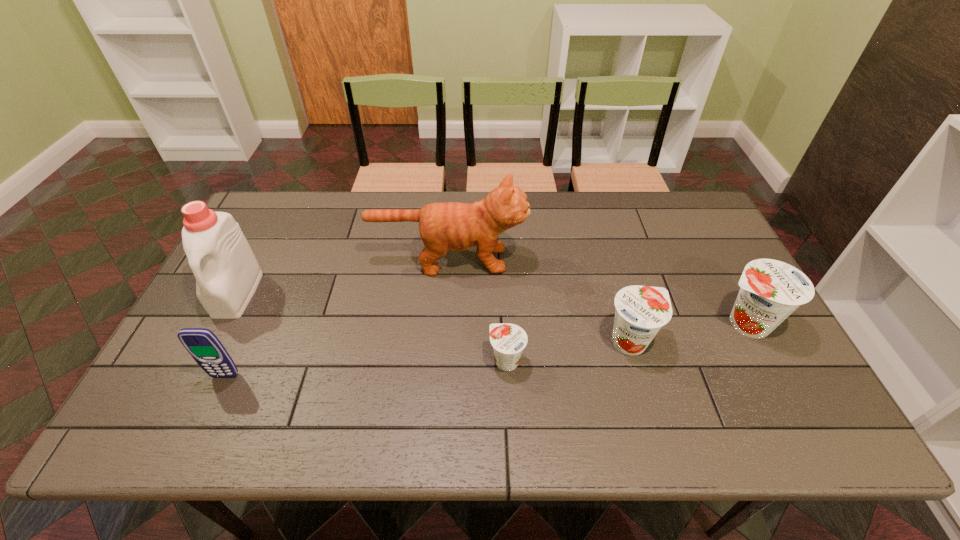
The width and height of the screenshot is (960, 540). What are the coordinates of `free point that keeps the yogurts evenly spaced on the left` in the screenshot? It's located at (374, 382).